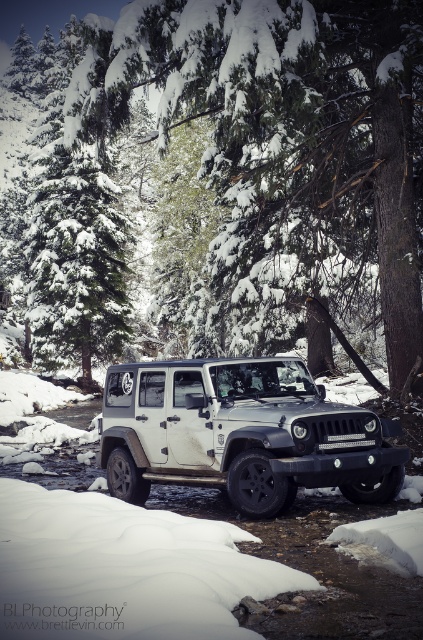
At what (x,y) coordinates should I click in order to perform the action: click on green textured pine tree at upper center. Please return your answer as a coordinate pair (x, y). The width and height of the screenshot is (423, 640). Looking at the image, I should click on (282, 138).

Is green textured pine tree at upper center closer to the viewer compared to white matte/soft jeep at center?

No, green textured pine tree at upper center is further to the viewer.

Describe the element at coordinates (282, 138) in the screenshot. This screenshot has height=640, width=423. I see `green textured pine tree at upper center` at that location.

The image size is (423, 640). What are the coordinates of `green textured pine tree at upper center` in the screenshot? It's located at (282, 138).

Does point (263, 476) come behind point (107, 200)?

No, it is in front of (107, 200).

The image size is (423, 640). Describe the element at coordinates (241, 433) in the screenshot. I see `white matte/soft jeep at center` at that location.

Which is in front, point (250, 476) or point (115, 330)?

Point (250, 476) is more forward.

In order to click on white matte/soft jeep at center in this screenshot , I will do `click(241, 433)`.

Which is above, green textured pine tree at upper center or snow-covered evergreen tree at upper left?

snow-covered evergreen tree at upper left is higher up.

How much distance is there between green textured pine tree at upper center and snow-covered evergreen tree at upper left?

A distance of 24.13 feet exists between green textured pine tree at upper center and snow-covered evergreen tree at upper left.

Is point (392, 333) closer to viewer compared to point (77, 108)?

Yes, point (392, 333) is in front of point (77, 108).

Identify the location of green textured pine tree at upper center. (282, 138).